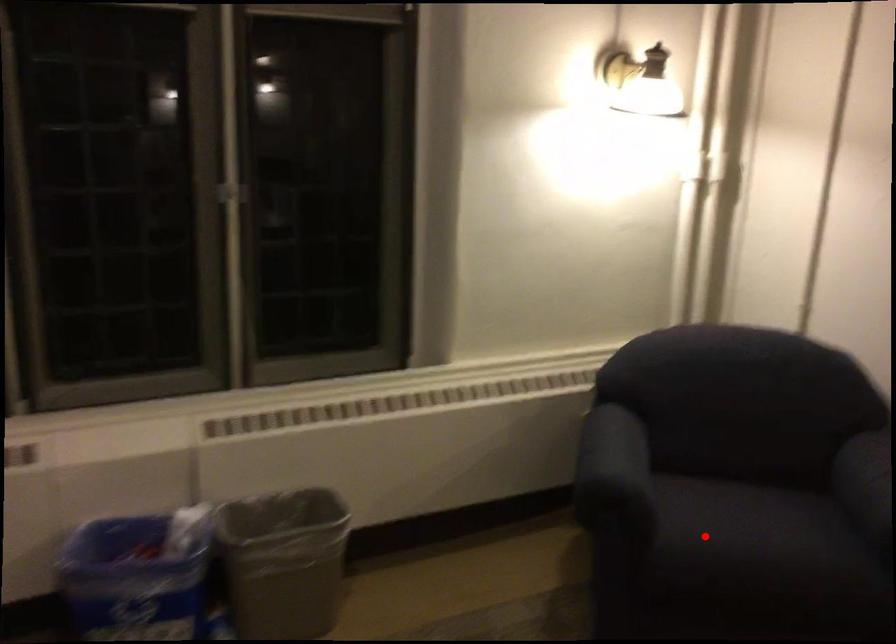
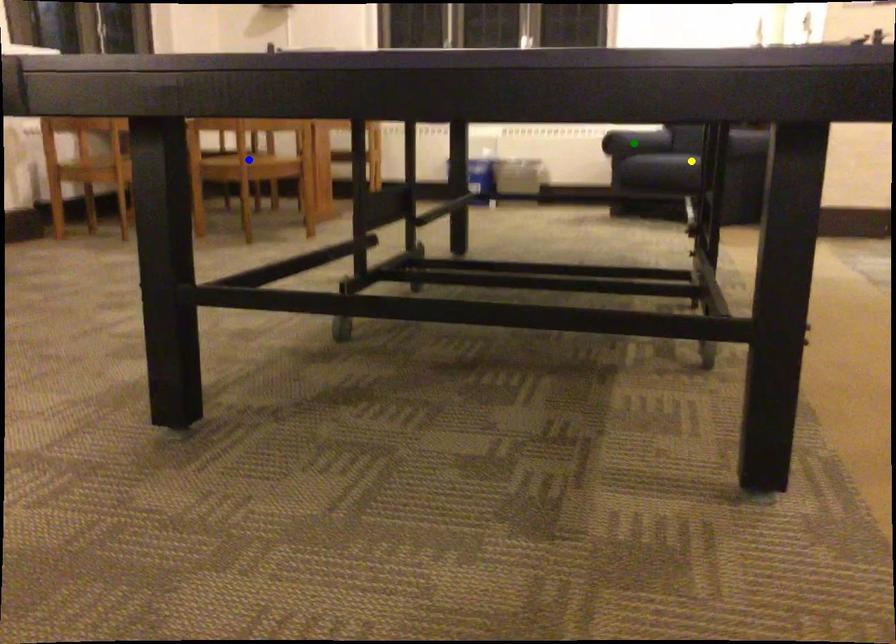
Question: I am providing you with two images of the same scene from different viewpoints. A red point is marked on the first image. You are given multiple points on the second image. Which spot in image 2 lines up with the point in image 1?

Choices:
 (A) green point
 (B) blue point
 (C) yellow point

Answer: (A)